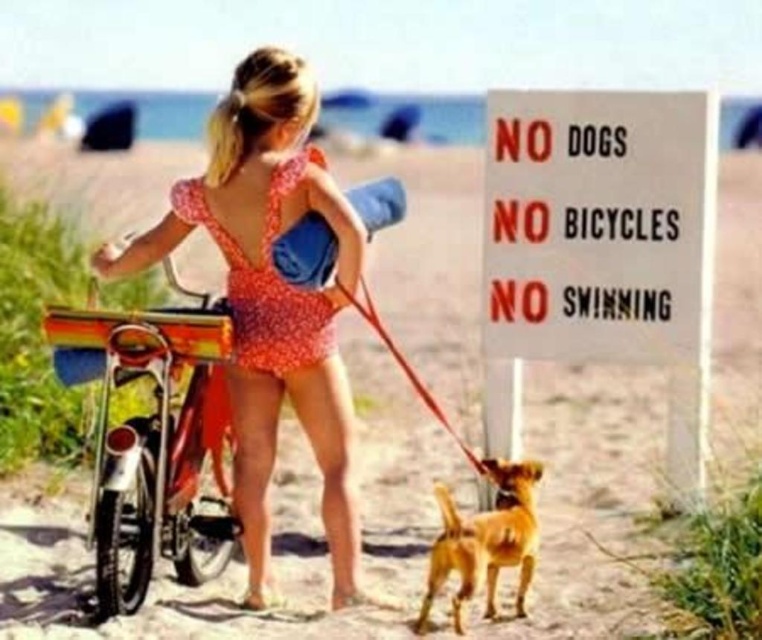
Question: Is the position of shiny chrome bicycle at center more distant than that of golden fur dog at lower center?

Choices:
 (A) yes
 (B) no

Answer: (A)

Question: Which of these objects is positioned farthest from the white paper sign at center?

Choices:
 (A) red nylon leash at center
 (B) golden fur dog at lower center
 (C) floral fabric swimsuit at center

Answer: (C)

Question: Estimate the real-world distances between objects in this image. Which object is closer to the golden fur dog at lower center?

Choices:
 (A) floral fabric swimsuit at center
 (B) shiny chrome bicycle at center
 (C) white paper sign at center

Answer: (A)

Question: From the image, what is the correct spatial relationship of shiny chrome bicycle at center in relation to golden fur dog at lower center?

Choices:
 (A) below
 (B) above

Answer: (B)

Question: Which point is farther from the camera taking this photo?

Choices:
 (A) (235, 179)
 (B) (460, 545)

Answer: (A)

Question: Is shiny chrome bicycle at center below golden fur dog at lower center?

Choices:
 (A) no
 (B) yes

Answer: (A)